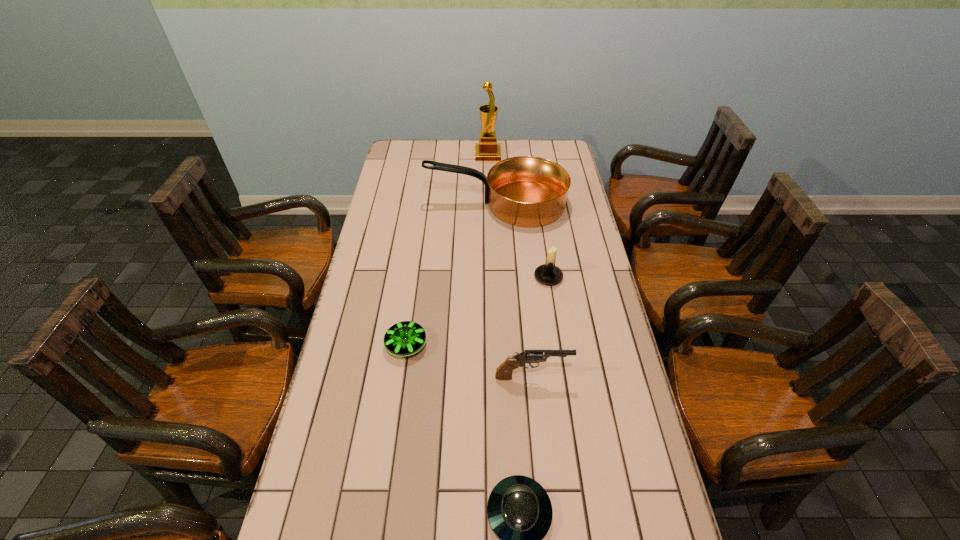
The image size is (960, 540). I want to click on the farthest object, so click(x=487, y=149).

Where is `award`? The width and height of the screenshot is (960, 540). award is located at coordinates (487, 149).

Identify the location of frying pan. This screenshot has width=960, height=540. (526, 191).

Locate an element on the screen. the fifth nearest object is located at coordinates (526, 191).

The height and width of the screenshot is (540, 960). Find the location of `the fourth shortest object`. the fourth shortest object is located at coordinates tap(549, 274).

I want to click on the third farthest object, so click(x=549, y=274).

This screenshot has width=960, height=540. I want to click on gun, so click(504, 372).

Where is `the fourth tallest object`? The image size is (960, 540). the fourth tallest object is located at coordinates (504, 372).

Where is `the left saucer`? The width and height of the screenshot is (960, 540). the left saucer is located at coordinates (405, 338).

Locate an element on the screen. This screenshot has height=540, width=960. the second shortest object is located at coordinates (405, 338).